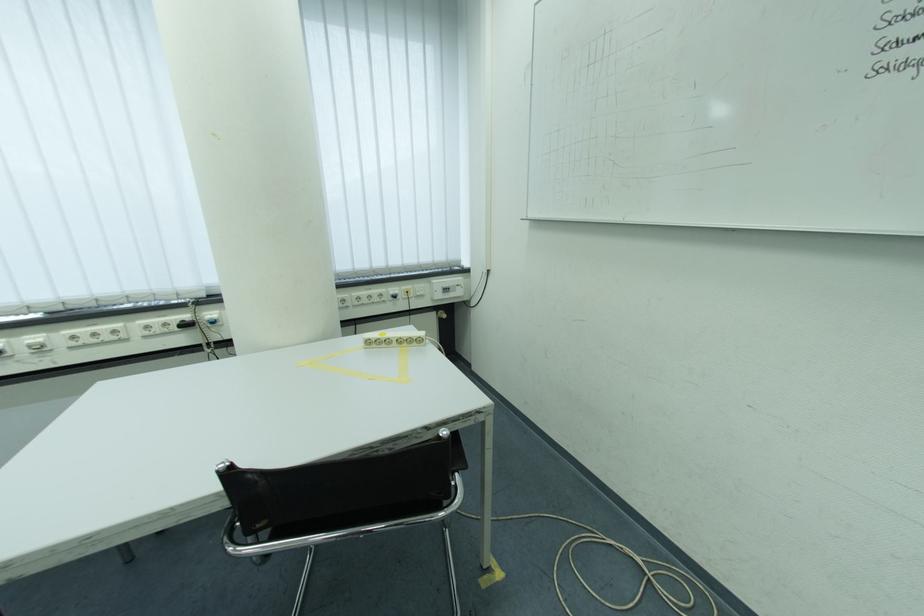
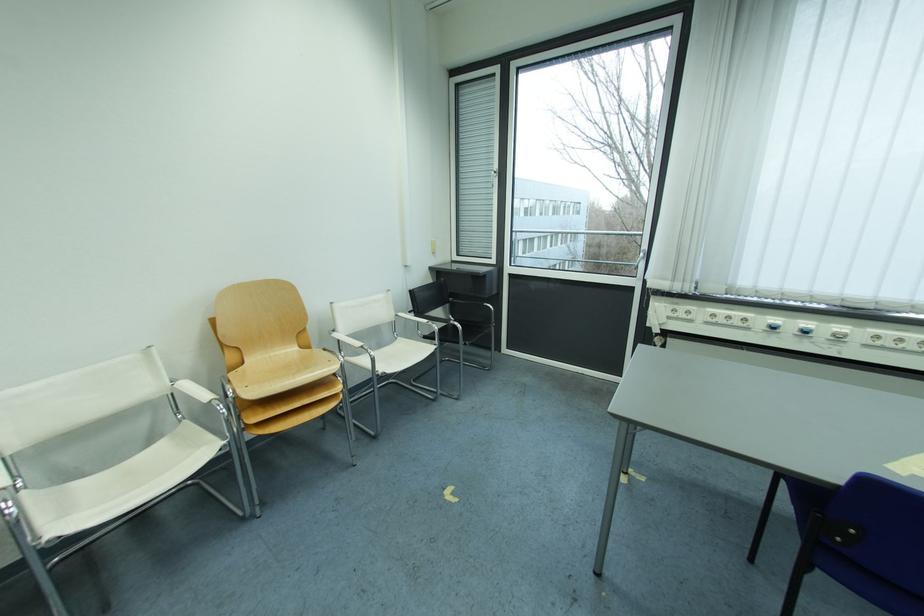
In the second image, find the point that corresponds to (79,351) in the first image.

(874, 347)